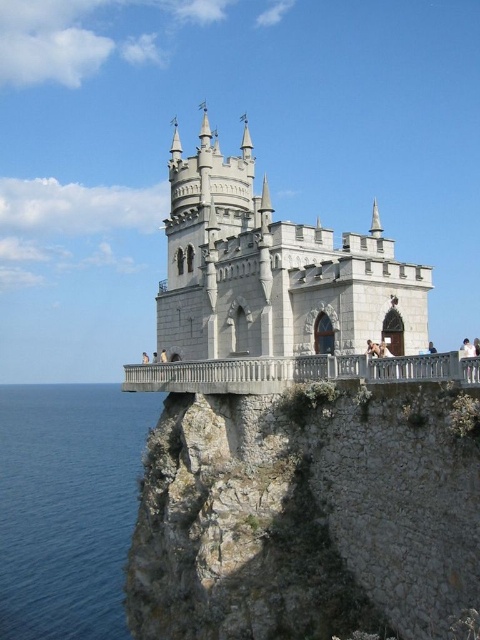
You are standing at the base of the cliff and see the point marked at coordinates (308, 515) on the gray rocky cliff at center. If you were to climb straight up from your current position, would you reach that point before reaching the top of the cliff?

The point marked at (308, 515) on the gray rocky cliff at center is located at the center of the cliff. Since you are at the base, climbing straight up would take you directly towards the top, so you would pass the marked point before reaching the top.

You are a bird flying above the castle scene. You want to land on the gray rocky cliff at center and then move to the blue water at lower left. Which direction should you fly after landing on the cliff to reach the water?

The blue water at lower left is located to the lower left of the gray rocky cliff at center. After landing on the gray rocky cliff at center, you should fly downward and toward the left to reach the blue water at lower left.

Based on the photo, you are an architect evaluating the proportions of the scene. Given the white stone castle at center and the blue water at lower left, which one has a greater width in the image?

The white stone castle at center has a greater width than the blue water at lower left, as stated in the description that its width surpasses the blue water at lower left.